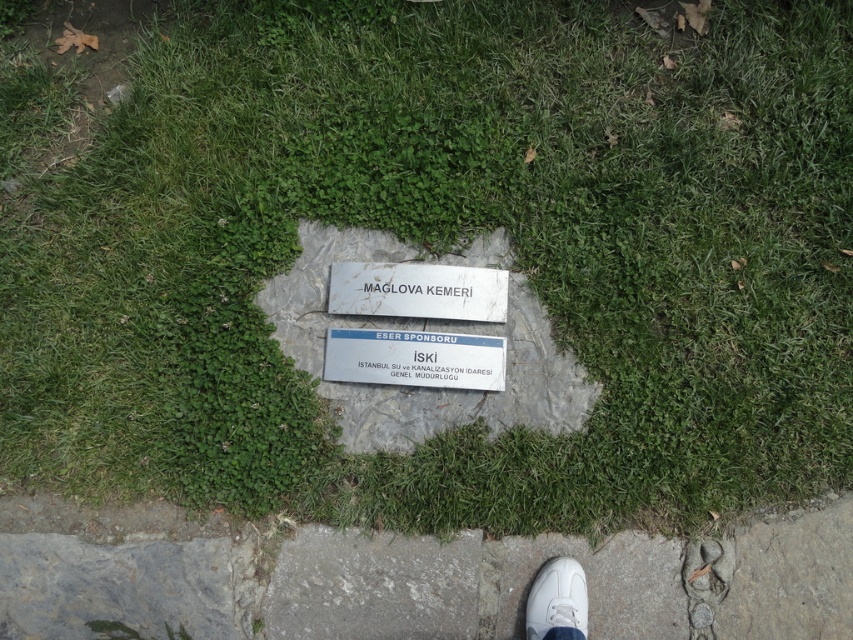
You are a delivery person trying to place a package on the gray concrete pavement at lower center and the white stone plaque at center. Which surface is taller and more elevated?

The gray concrete pavement at lower center is much taller than the white stone plaque at center, so the gray concrete pavement at lower center is the taller and more elevated surface.

From the picture: You are standing in a park and see the white stone plaque at center and the white leather shoe at lower center. Which object is positioned to the left when viewed from your perspective?

The white stone plaque at center is to the left of the white leather shoe at lower center.

You are standing in a park and see the white stone plaque at center and the white leather shoe at lower center. Which object is closer to you?

The white stone plaque at center is closer to you than the white leather shoe at lower center because it is further to the viewer.